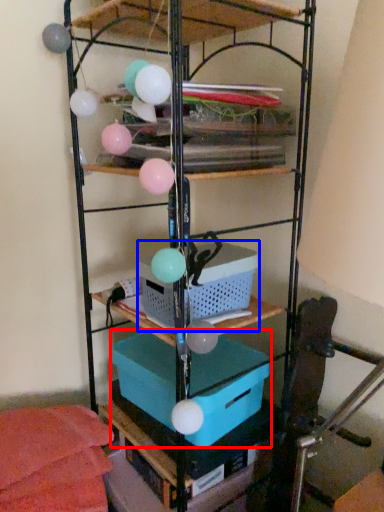
Question: Among these objects, which one is farthest to the camera, box (highlighted by a red box) or basket (highlighted by a blue box)?

Choices:
 (A) box
 (B) basket

Answer: (A)